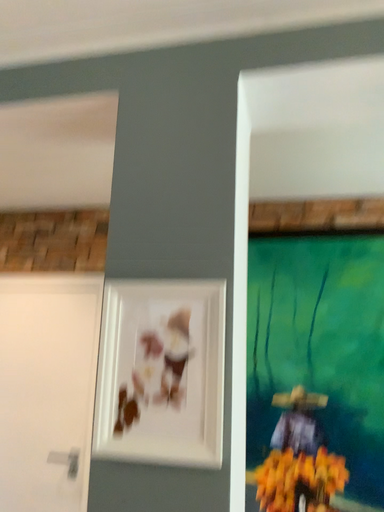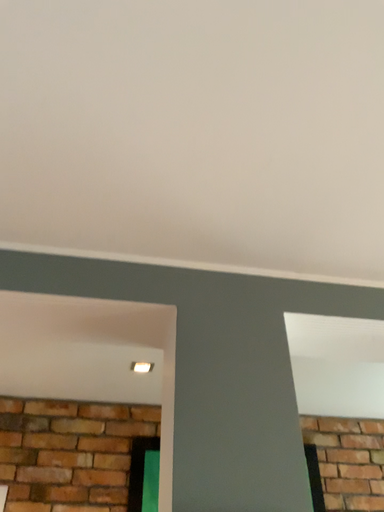
Question: Which way did the camera rotate in the video?

Choices:
 (A) rotated downward
 (B) rotated upward

Answer: (B)